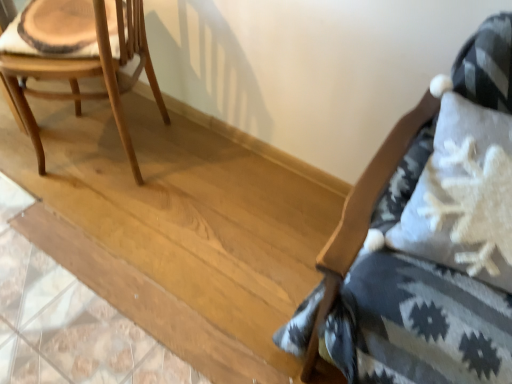
What do you see at coordinates (78, 57) in the screenshot? I see `natural wood chair at left, the second chair viewed from the right` at bounding box center [78, 57].

This screenshot has width=512, height=384. I want to click on natural wood chair at left, which ranks as the first chair in left-to-right order, so click(x=78, y=57).

Measure the distance between natural wood chair at left, the second chair viewed from the right, and camera.

A distance of 3.73 feet exists between natural wood chair at left, the second chair viewed from the right, and camera.

Locate an element on the screen. Image resolution: width=512 pixels, height=384 pixels. textured gray cushion at right, the first chair viewed from the right is located at coordinates 408,324.

What do you see at coordinates (408, 324) in the screenshot? The image size is (512, 384). I see `textured gray cushion at right, the first chair viewed from the right` at bounding box center [408, 324].

Image resolution: width=512 pixels, height=384 pixels. I want to click on natural wood chair at left, which ranks as the first chair in left-to-right order, so click(78, 57).

Considering the relative positions of textured gray cushion at right, the first chair viewed from the right, and natural wood chair at left, the second chair viewed from the right, in the image provided, is textured gray cushion at right, the first chair viewed from the right, to the left or to the right of natural wood chair at left, the second chair viewed from the right,?

From the image, it's evident that textured gray cushion at right, the first chair viewed from the right, is to the right of natural wood chair at left, the second chair viewed from the right.

Which object is closer to the camera taking this photo, textured gray cushion at right, the first chair viewed from the right, or natural wood chair at left, the second chair viewed from the right?

Positioned in front is textured gray cushion at right, the first chair viewed from the right.

Is point (297, 317) closer or farther from the camera than point (137, 20)?

Clearly, point (297, 317) is closer to the camera than point (137, 20).

From the image's perspective, between textured gray cushion at right, the first chair viewed from the right, and natural wood chair at left, the second chair viewed from the right, which one is located above?

natural wood chair at left, the second chair viewed from the right, appears higher in the image.

From a real-world perspective, which object stands above the other?

From a 3D spatial view, textured gray cushion at right, acting as the second chair starting from the left, is above.

Is textured gray cushion at right, acting as the second chair starting from the left, wider or thinner than natural wood chair at left, which ranks as the first chair in left-to-right order?

textured gray cushion at right, acting as the second chair starting from the left, is wider than natural wood chair at left, which ranks as the first chair in left-to-right order.

Considering the sizes of objects textured gray cushion at right, the first chair viewed from the right, and natural wood chair at left, the second chair viewed from the right, in the image provided, who is taller, textured gray cushion at right, the first chair viewed from the right, or natural wood chair at left, the second chair viewed from the right,?

With more height is textured gray cushion at right, the first chair viewed from the right.

Considering the relative sizes of textured gray cushion at right, acting as the second chair starting from the left, and natural wood chair at left, the second chair viewed from the right, in the image provided, is textured gray cushion at right, acting as the second chair starting from the left, bigger than natural wood chair at left, the second chair viewed from the right,?

Yes, textured gray cushion at right, acting as the second chair starting from the left, is bigger than natural wood chair at left, the second chair viewed from the right.

From the picture: Is natural wood chair at left, which ranks as the first chair in left-to-right order, a part of textured gray cushion at right, the first chair viewed from the right?

No, natural wood chair at left, which ranks as the first chair in left-to-right order, is not surrounded by textured gray cushion at right, the first chair viewed from the right.

Is textured gray cushion at right, acting as the second chair starting from the left, next to natural wood chair at left, which ranks as the first chair in left-to-right order?

No, textured gray cushion at right, acting as the second chair starting from the left, is not in contact with natural wood chair at left, which ranks as the first chair in left-to-right order.

Could you tell me if textured gray cushion at right, the first chair viewed from the right, is turned towards natural wood chair at left, the second chair viewed from the right?

No.

The width and height of the screenshot is (512, 384). I want to click on chair behind the textured gray cushion at right, the first chair viewed from the right, so click(78, 57).

Is natural wood chair at left, which ranks as the first chair in left-to-right order, at the right side of textured gray cushion at right, the first chair viewed from the right?

No, natural wood chair at left, which ranks as the first chair in left-to-right order, is not to the right of textured gray cushion at right, the first chair viewed from the right.

Which is behind, natural wood chair at left, which ranks as the first chair in left-to-right order, or textured gray cushion at right, the first chair viewed from the right?

natural wood chair at left, which ranks as the first chair in left-to-right order, is further away from the camera.

Does point (32, 68) come farther from viewer compared to point (457, 297)?

Yes.

From the image's perspective, which is above, natural wood chair at left, the second chair viewed from the right, or textured gray cushion at right, acting as the second chair starting from the left?

natural wood chair at left, the second chair viewed from the right.

From a real-world perspective, between natural wood chair at left, the second chair viewed from the right, and textured gray cushion at right, acting as the second chair starting from the left, who is vertically lower?

natural wood chair at left, the second chair viewed from the right.

Is natural wood chair at left, the second chair viewed from the right, thinner than textured gray cushion at right, the first chair viewed from the right?

Yes, natural wood chair at left, the second chair viewed from the right, is thinner than textured gray cushion at right, the first chair viewed from the right.

Can you confirm if natural wood chair at left, the second chair viewed from the right, is shorter than textured gray cushion at right, acting as the second chair starting from the left?

Yes, natural wood chair at left, the second chair viewed from the right, is shorter than textured gray cushion at right, acting as the second chair starting from the left.

In terms of size, does natural wood chair at left, the second chair viewed from the right, appear bigger or smaller than textured gray cushion at right, acting as the second chair starting from the left?

Clearly, natural wood chair at left, the second chair viewed from the right, is smaller in size than textured gray cushion at right, acting as the second chair starting from the left.

Is natural wood chair at left, the second chair viewed from the right, surrounding textured gray cushion at right, acting as the second chair starting from the left?

No, textured gray cushion at right, acting as the second chair starting from the left, is located outside of natural wood chair at left, the second chair viewed from the right.

Would you say natural wood chair at left, which ranks as the first chair in left-to-right order, is a long distance from textured gray cushion at right, acting as the second chair starting from the left?

That's right, there is a large distance between natural wood chair at left, which ranks as the first chair in left-to-right order, and textured gray cushion at right, acting as the second chair starting from the left.

Is natural wood chair at left, the second chair viewed from the right, looking in the opposite direction of textured gray cushion at right, acting as the second chair starting from the left?

No, natural wood chair at left, the second chair viewed from the right,'s orientation is not away from textured gray cushion at right, acting as the second chair starting from the left.

At what (x,y) coordinates should I click in order to perform the action: click on chair located on the right of natural wood chair at left, the second chair viewed from the right. Please return your answer as a coordinate pair (x, y). Looking at the image, I should click on (408, 324).

You are a GUI agent. You are given a task and a screenshot of the screen. Output one action in this format:
    pyautogui.click(x=<x>, y=<y>)
    Task: Click on the chair that appears below the textured gray cushion at right, acting as the second chair starting from the left (from a real-world perspective)
    
    Given the screenshot: What is the action you would take?
    pyautogui.click(x=78, y=57)

At what (x,y) coordinates should I click in order to perform the action: click on chair behind the textured gray cushion at right, the first chair viewed from the right. Please return your answer as a coordinate pair (x, y). This screenshot has height=384, width=512. Looking at the image, I should click on (78, 57).